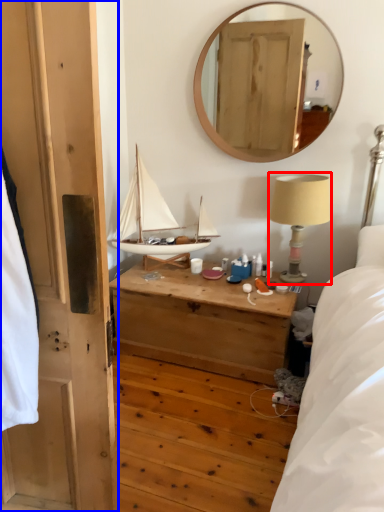
Question: Which object appears farthest to the camera in this image, table lamp (highlighted by a red box) or door (highlighted by a blue box)?

Choices:
 (A) table lamp
 (B) door

Answer: (A)